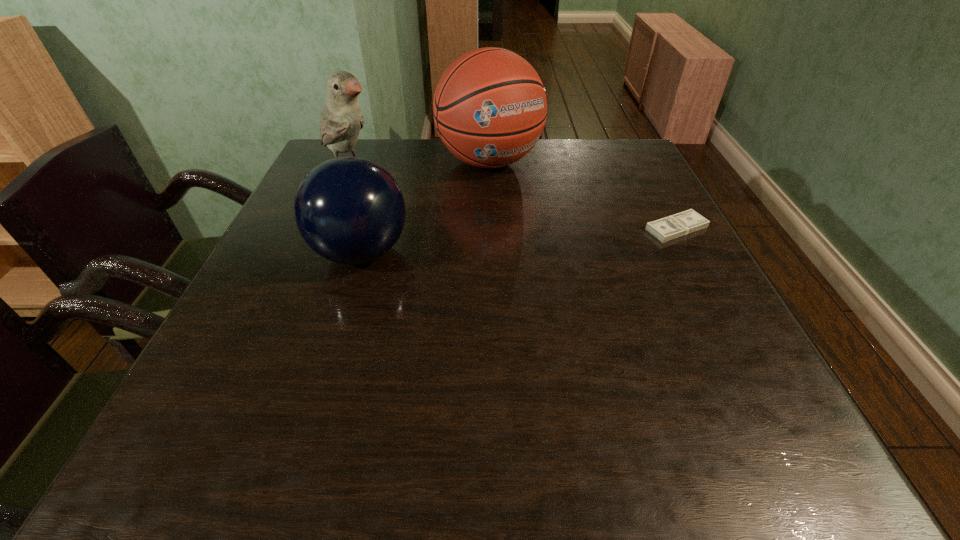
The height and width of the screenshot is (540, 960). Identify the location of free space on the desktop that is between the second shortest object and the money and is positioned on the logo side of the basketball. (564, 237).

Identify the location of free space on the desktop that is between the third tallest object and the rightmost object and is positioned at the face of the bird. The image size is (960, 540). (486, 243).